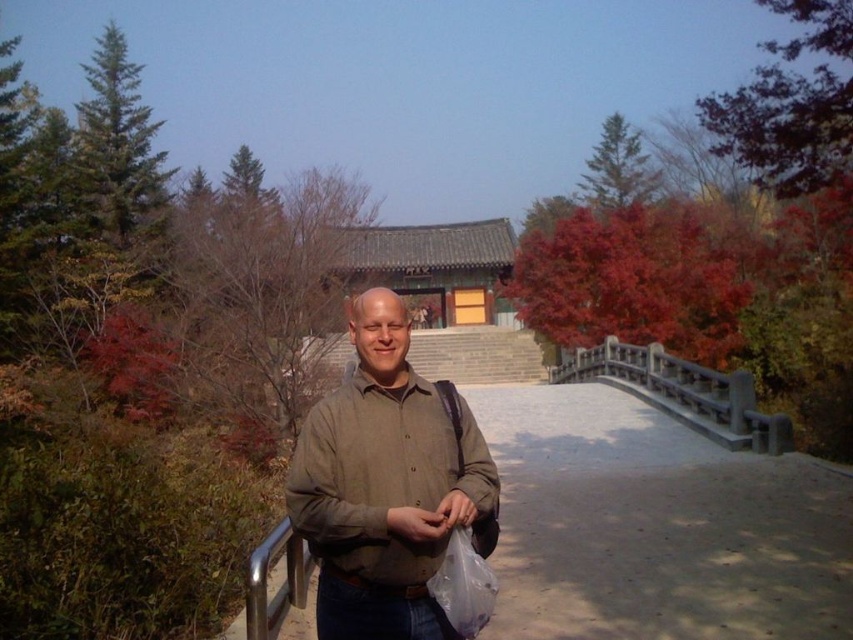
Consider the image. You are a photographer trying to capture a wide shot of the scene. The matte brown shirt at center and the black stone bridge at center are both in your frame. Considering their sizes in the image, which object should you focus on to ensure both are clearly visible without cropping?

The matte brown shirt at center occupies less space than the black stone bridge at center. To ensure both are clearly visible without cropping, focus on the black stone bridge at center since it is larger and will remain in frame while the smaller matte brown shirt at center will also fit within the shot.

You are standing at the point with coordinates point (276,616) and want to walk towards the point (329,552). According to the image, which direction should you face to move towards your destination?

Point (329,552) is in front of point (276,616), so you should face forward to move towards it.